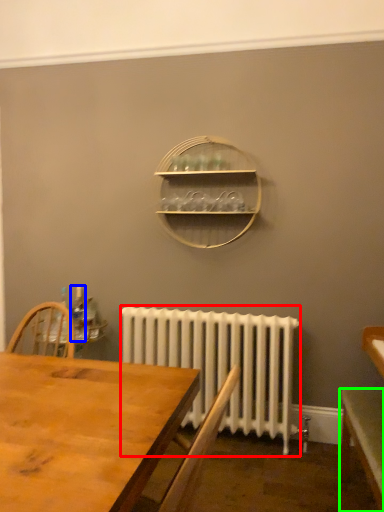
Question: Considering the real-world distances, which object is closest to radiator (highlighted by a red box)? bottle (highlighted by a blue box) or table (highlighted by a green box).

Choices:
 (A) bottle
 (B) table

Answer: (B)